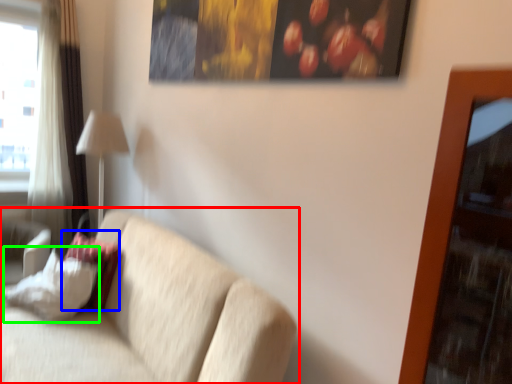
Question: Based on their relative distances, which object is nearer to studio couch (highlighted by a red box)? Choose from pillow (highlighted by a blue box) and pillow (highlighted by a green box).

Choices:
 (A) pillow
 (B) pillow

Answer: (B)